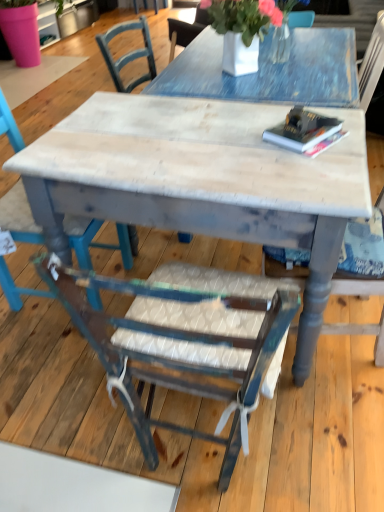
The width and height of the screenshot is (384, 512). Identify the location of distressed wood table at center. (202, 181).

Measure the distance between wooden chair at right, which is counted as the third chair, starting from the left, and camera.

They are 3.91 feet apart.

Where is `distressed wood chair at lower left, which is counted as the third chair, starting from the right`? This screenshot has height=512, width=384. distressed wood chair at lower left, which is counted as the third chair, starting from the right is located at coordinates (95, 242).

Measure the distance between point (18, 298) and camera.

Point (18, 298) and camera are 5.89 feet apart.

You are a GUI agent. You are given a task and a screenshot of the screen. Output one action in this format:
    pyautogui.click(x=<x>, y=<y>)
    Task: Click on the wooden chair with woven seat at center, which is the 2th chair in right-to-left order
    Image resolution: width=384 pixels, height=512 pixels.
    Given the screenshot: What is the action you would take?
    pyautogui.click(x=183, y=339)

You are a GUI agent. You are given a task and a screenshot of the screen. Output one action in this format:
    pyautogui.click(x=<x>, y=<y>)
    Task: Click on the distressed wood table at center
    
    Given the screenshot: What is the action you would take?
    pyautogui.click(x=202, y=181)

Is hardcover book at upper right positioned beyond the bounds of distressed wood table at center?

No.

At what (x,y) coordinates should I click in order to perform the action: click on book located behind the distressed wood table at center. Please return your answer as a coordinate pair (x, y). This screenshot has width=384, height=512. Looking at the image, I should click on (302, 130).

Looking at this image, considering the relative sizes of hardcover book at upper right and distressed wood table at center in the image provided, is hardcover book at upper right wider than distressed wood table at center?

Incorrect, the width of hardcover book at upper right does not surpass that of distressed wood table at center.

Does wooden chair with woven seat at center, which is the 2th chair in right-to-left order, have a larger size compared to hardcover book at upper right?

Yes.

Between wooden chair with woven seat at center, which is the 2th chair in right-to-left order, and hardcover book at upper right, which one has smaller width?

Thinner between the two is hardcover book at upper right.

Between point (238, 421) and point (323, 137), which one is positioned behind?

Point (323, 137)

Consider the image. How much distance is there between wooden chair at right, which is counted as the third chair, starting from the left, and wooden chair with woven seat at center, which is the 2th chair in right-to-left order?

wooden chair at right, which is counted as the third chair, starting from the left, and wooden chair with woven seat at center, which is the 2th chair in right-to-left order, are 16.55 inches apart from each other.

From a real-world perspective, which object rests below the other?

wooden chair with woven seat at center, which is the 2th chair in left-to-right order, is physically lower.

Based on the photo, is wooden chair with woven seat at center, which is the 2th chair in right-to-left order, located within wooden chair at right, which is counted as the third chair, starting from the left?

No, wooden chair at right, which is counted as the third chair, starting from the left, does not contain wooden chair with woven seat at center, which is the 2th chair in right-to-left order.

Between wooden chair at right, which is counted as the third chair, starting from the left, and wooden chair with woven seat at center, which is the 2th chair in right-to-left order, which one has larger width?

Wider between the two is wooden chair at right, which is counted as the third chair, starting from the left.

From a real-world perspective, is wooden chair with woven seat at center, which is the 2th chair in left-to-right order, physically located above or below distressed wood chair at lower left, which appears as the 1th chair when viewed from the left?

In terms of real-world spatial position, wooden chair with woven seat at center, which is the 2th chair in left-to-right order, is below distressed wood chair at lower left, which appears as the 1th chair when viewed from the left.

Image resolution: width=384 pixels, height=512 pixels. In order to click on the 2nd chair below when counting from the distressed wood chair at lower left, which is counted as the third chair, starting from the right (from the image's perspective) in this screenshot , I will do `click(183, 339)`.

Is wooden chair with woven seat at center, which is the 2th chair in left-to-right order, positioned beyond the bounds of distressed wood chair at lower left, which appears as the 1th chair when viewed from the left?

Indeed, wooden chair with woven seat at center, which is the 2th chair in left-to-right order, is completely outside distressed wood chair at lower left, which appears as the 1th chair when viewed from the left.

Between wooden chair with woven seat at center, which is the 2th chair in left-to-right order, and distressed wood chair at lower left, which appears as the 1th chair when viewed from the left, which one has less height?

wooden chair with woven seat at center, which is the 2th chair in left-to-right order, is shorter.

Find the location of `chair that is the 2nd object located below the distressed wood table at center (from the image's perspective)`. chair that is the 2nd object located below the distressed wood table at center (from the image's perspective) is located at coordinates (183, 339).

Is distressed wood table at center not close to wooden chair with woven seat at center, which is the 2th chair in left-to-right order?

No.

Which object is further away from the camera, distressed wood table at center or wooden chair with woven seat at center, which is the 2th chair in right-to-left order?

distressed wood table at center is further away from the camera.

Is hardcover book at upper right to the left of wooden chair with woven seat at center, which is the 2th chair in left-to-right order, from the viewer's perspective?

No, hardcover book at upper right is not to the left of wooden chair with woven seat at center, which is the 2th chair in left-to-right order.

Is hardcover book at upper right not close to wooden chair with woven seat at center, which is the 2th chair in left-to-right order?

They are positioned close to each other.

Looking at their sizes, would you say hardcover book at upper right is wider or thinner than wooden chair with woven seat at center, which is the 2th chair in right-to-left order?

In the image, hardcover book at upper right appears to be more narrow than wooden chair with woven seat at center, which is the 2th chair in right-to-left order.

Can we say hardcover book at upper right lies outside wooden chair with woven seat at center, which is the 2th chair in right-to-left order?

Yes, hardcover book at upper right is not within wooden chair with woven seat at center, which is the 2th chair in right-to-left order.

Is hardcover book at upper right positioned in front of wooden chair at right, which is counted as the third chair, starting from the left?

That is False.

From the image's perspective, between hardcover book at upper right and wooden chair at right, arranged as the first chair when viewed from the right, who is located below?

wooden chair at right, arranged as the first chair when viewed from the right.

Which point is more forward, (333, 120) or (357, 295)?

The point (333, 120) is in front.

At what (x,y) coordinates should I click in order to perform the action: click on kitchen & dining room table below the hardcover book at upper right (from a real-world perspective). Please return your answer as a coordinate pair (x, y). The image size is (384, 512). Looking at the image, I should click on (202, 181).

This screenshot has height=512, width=384. What are the coordinates of `book that is on the right side of wooden chair with woven seat at center, which is the 2th chair in right-to-left order` in the screenshot? It's located at (302, 130).

Which object lies nearer to the anchor point distressed wood chair at lower left, which is counted as the third chair, starting from the right, wooden chair with woven seat at center, which is the 2th chair in left-to-right order, or distressed wood table at center?

Based on the image, distressed wood table at center appears to be nearer to distressed wood chair at lower left, which is counted as the third chair, starting from the right.

Based on their spatial positions, is wooden chair at right, arranged as the first chair when viewed from the right, or wooden chair with woven seat at center, which is the 2th chair in right-to-left order, closer to distressed wood chair at lower left, which appears as the 1th chair when viewed from the left?

wooden chair with woven seat at center, which is the 2th chair in right-to-left order, is positioned closer to the anchor distressed wood chair at lower left, which appears as the 1th chair when viewed from the left.

Looking at the image, which one is located further to distressed wood table at center, hardcover book at upper right or wooden chair at right, arranged as the first chair when viewed from the right?

wooden chair at right, arranged as the first chair when viewed from the right, lies further to distressed wood table at center than the other object.

When comparing their distances from distressed wood table at center, does wooden chair at right, arranged as the first chair when viewed from the right, or wooden chair with woven seat at center, which is the 2th chair in right-to-left order, seem further?

wooden chair at right, arranged as the first chair when viewed from the right, is positioned further to the anchor distressed wood table at center.

From the image, which object appears to be farther from distressed wood table at center, hardcover book at upper right or wooden chair with woven seat at center, which is the 2th chair in right-to-left order?

The object further to distressed wood table at center is wooden chair with woven seat at center, which is the 2th chair in right-to-left order.

Based on their spatial positions, is distressed wood chair at lower left, which appears as the 1th chair when viewed from the left, or wooden chair at right, which is counted as the third chair, starting from the left, closer to wooden chair with woven seat at center, which is the 2th chair in left-to-right order?

wooden chair at right, which is counted as the third chair, starting from the left, is closer to wooden chair with woven seat at center, which is the 2th chair in left-to-right order.

Looking at the image, which one is located further to distressed wood table at center, distressed wood chair at lower left, which is counted as the third chair, starting from the right, or wooden chair with woven seat at center, which is the 2th chair in right-to-left order?

distressed wood chair at lower left, which is counted as the third chair, starting from the right, lies further to distressed wood table at center than the other object.

From the image, which object appears to be farther from wooden chair with woven seat at center, which is the 2th chair in right-to-left order, hardcover book at upper right or distressed wood chair at lower left, which appears as the 1th chair when viewed from the left?

Among the two, distressed wood chair at lower left, which appears as the 1th chair when viewed from the left, is located further to wooden chair with woven seat at center, which is the 2th chair in right-to-left order.

Find the location of `chair between distressed wood chair at lower left, which appears as the 1th chair when viewed from the left, and wooden chair at right, which is counted as the third chair, starting from the left, in the horizontal direction`. chair between distressed wood chair at lower left, which appears as the 1th chair when viewed from the left, and wooden chair at right, which is counted as the third chair, starting from the left, in the horizontal direction is located at coordinates (183, 339).

Where is `kitchen & dining room table situated between distressed wood chair at lower left, which appears as the 1th chair when viewed from the left, and hardcover book at upper right from left to right`? Image resolution: width=384 pixels, height=512 pixels. kitchen & dining room table situated between distressed wood chair at lower left, which appears as the 1th chair when viewed from the left, and hardcover book at upper right from left to right is located at coordinates (202, 181).

This screenshot has width=384, height=512. In order to click on chair between distressed wood table at center and wooden chair at right, arranged as the first chair when viewed from the right in this screenshot , I will do `click(183, 339)`.

The image size is (384, 512). What are the coordinates of `kitchen & dining room table between hardcover book at upper right and wooden chair with woven seat at center, which is the 2th chair in right-to-left order, vertically` in the screenshot? It's located at (202, 181).